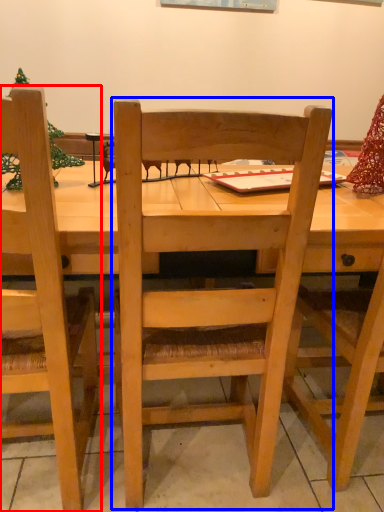
Question: Which of the following is the closest to the observer, chair (highlighted by a red box) or chair (highlighted by a blue box)?

Choices:
 (A) chair
 (B) chair

Answer: (A)